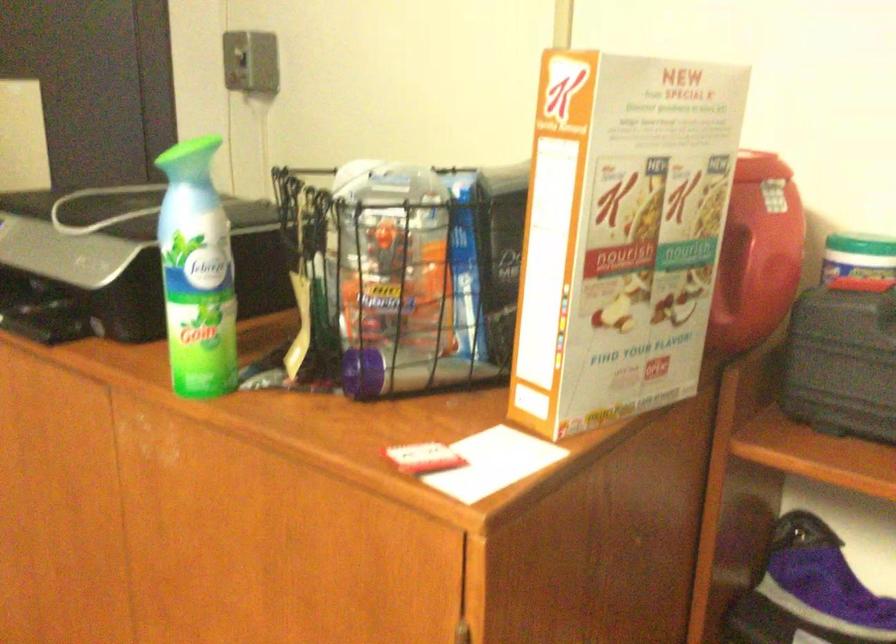
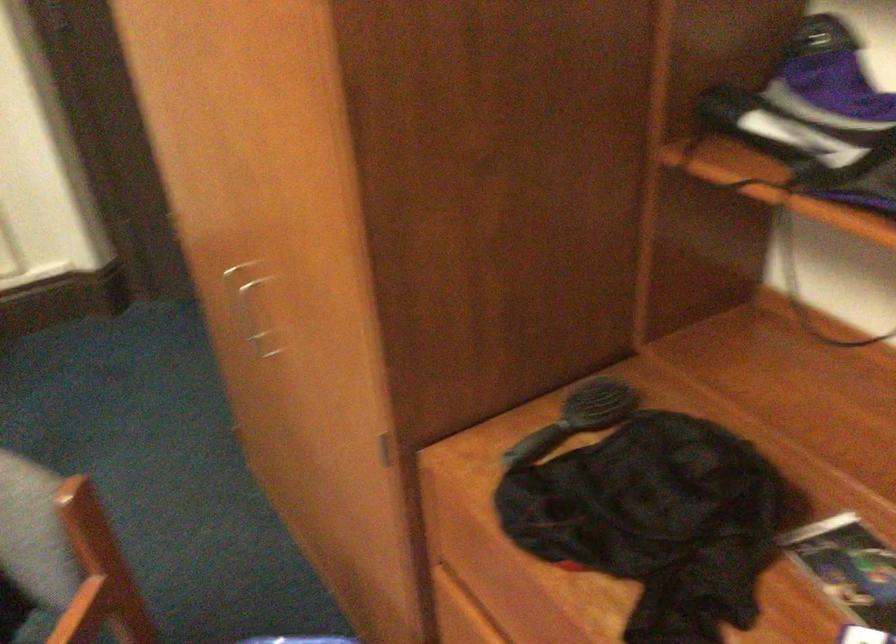
Question: What movement of the cameraman would produce the second image?

Choices:
 (A) Left
 (B) Right
 (C) Forward
 (D) Backward

Answer: (B)